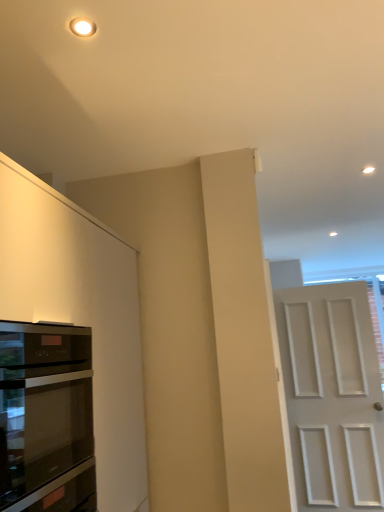
Question: In terms of height, does black glass oven at left look taller or shorter compared to matte white cabinet at left?

Choices:
 (A) short
 (B) tall

Answer: (A)

Question: Choose the correct answer: Is black glass oven at left inside matte white cabinet at left or outside it?

Choices:
 (A) outside
 (B) inside

Answer: (B)

Question: Considering the real-world distances, which object is farthest from the black glass oven at left?

Choices:
 (A) white matte door at right
 (B) matte white cabinet at left

Answer: (A)

Question: Based on their relative distances, which object is nearer to the matte white cabinet at left?

Choices:
 (A) white matte door at right
 (B) black glass oven at left

Answer: (B)